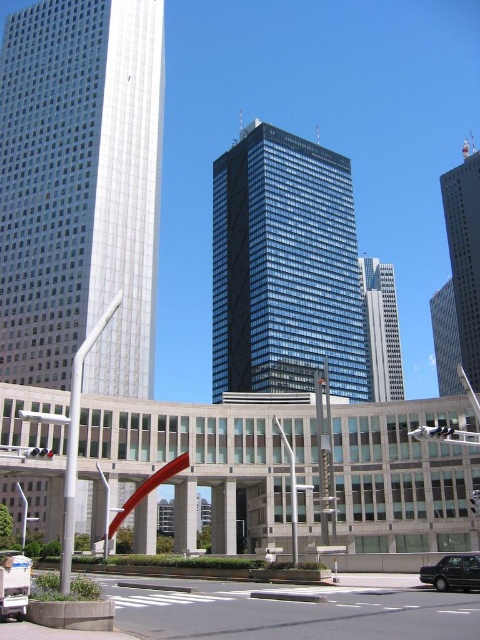
Question: Which is nearer to the black glossy sedan at lower right?

Choices:
 (A) silver glass skyscraper at left
 (B) glassy steel skyscraper at center

Answer: (A)

Question: Is glassy reflective skyscraper at right smaller than glassy steel skyscraper at center?

Choices:
 (A) no
 (B) yes

Answer: (A)

Question: Considering the real-world distances, which object is farthest from the silver glass skyscraper at left?

Choices:
 (A) black glossy sedan at lower right
 (B) glassy steel skyscraper at center
 (C) glassy blue skyscraper at center
 (D) glassy reflective skyscraper at right

Answer: (D)

Question: Which object is farther from the camera taking this photo?

Choices:
 (A) black glossy sedan at lower right
 (B) glassy reflective skyscraper at right

Answer: (B)

Question: Can you confirm if silver glass skyscraper at left is bigger than glassy reflective skyscraper at right?

Choices:
 (A) yes
 (B) no

Answer: (B)

Question: Is silver glass skyscraper at left positioned at the back of glassy steel skyscraper at center?

Choices:
 (A) yes
 (B) no

Answer: (B)